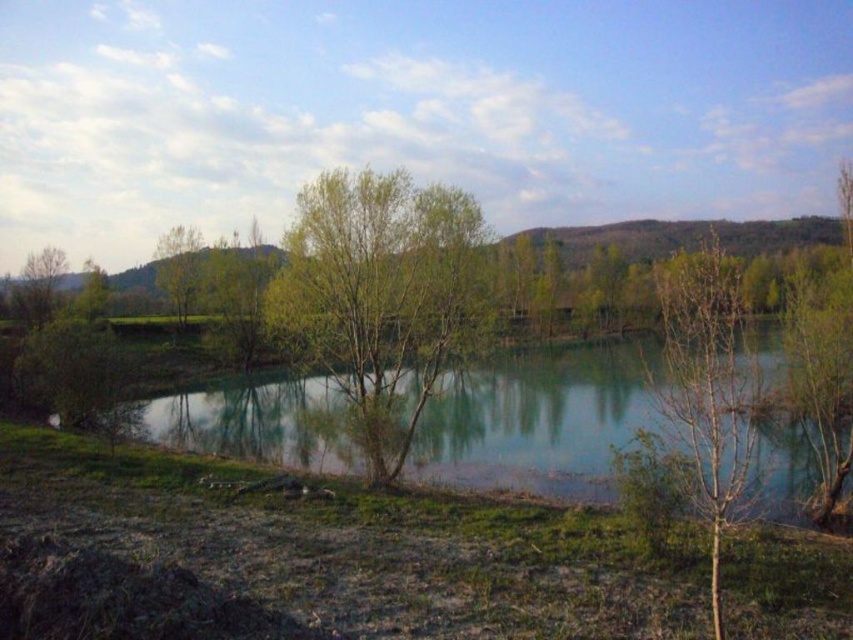
You are a bird looking for a nesting spot. You see the bare wood tree at center and the green matte tree at left. Which tree is taller and better for nesting?

The bare wood tree at center is much taller than the green matte tree at left, so it would be better for nesting.

You are standing at the edge of the pond and want to locate the green reflective water at center. According to the coordinates provided, in which direction should you look relative to your position?

The green reflective water at center is located at coordinates point (543, 419). Since the coordinate system typically places the origin at the bottom left corner, looking towards the upper right direction from your position at the edge would allow you to find it.